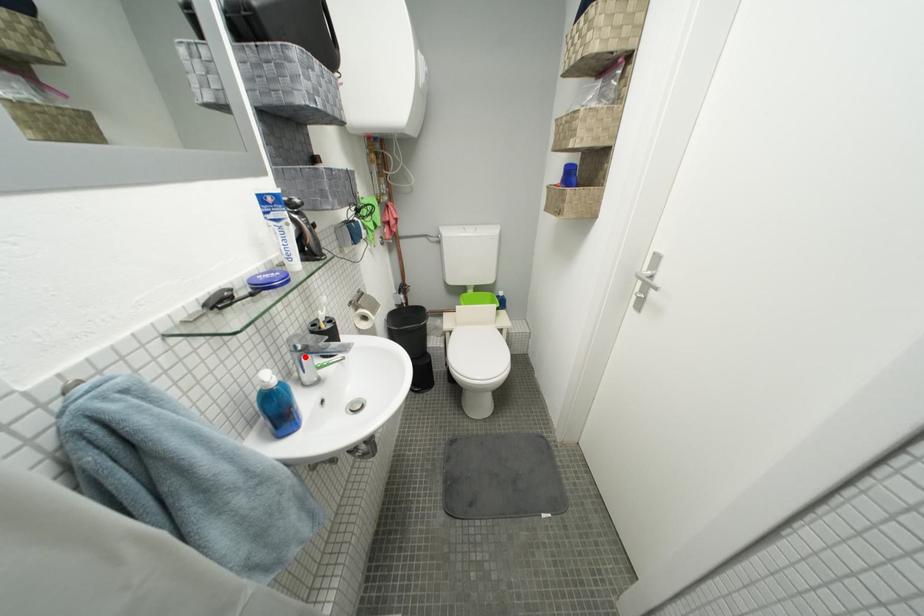
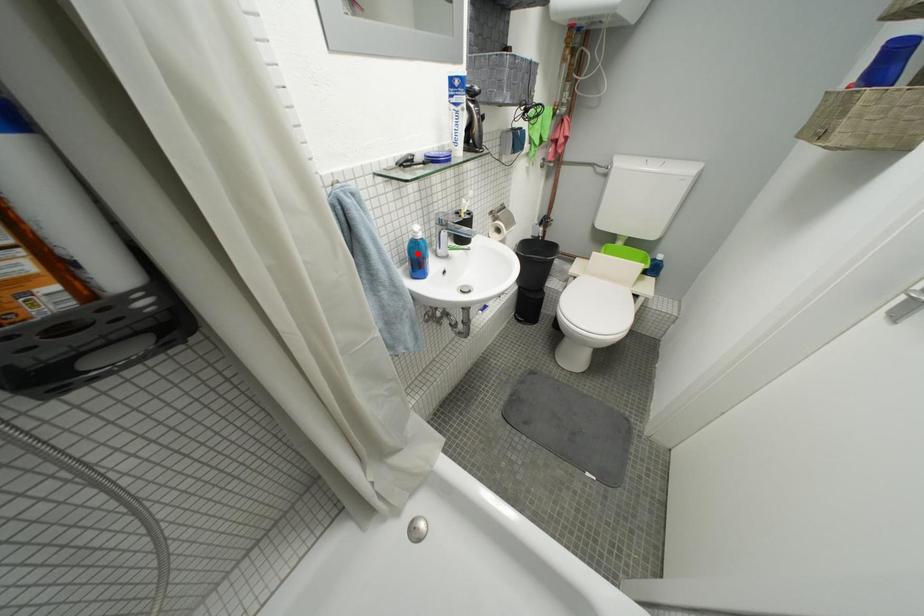
I am providing you with two images of the same scene from different viewpoints. A red point is marked on the first image and another point is marked on the second image. Does the point marked in image1 correspond to the same location as the one in image2?

No